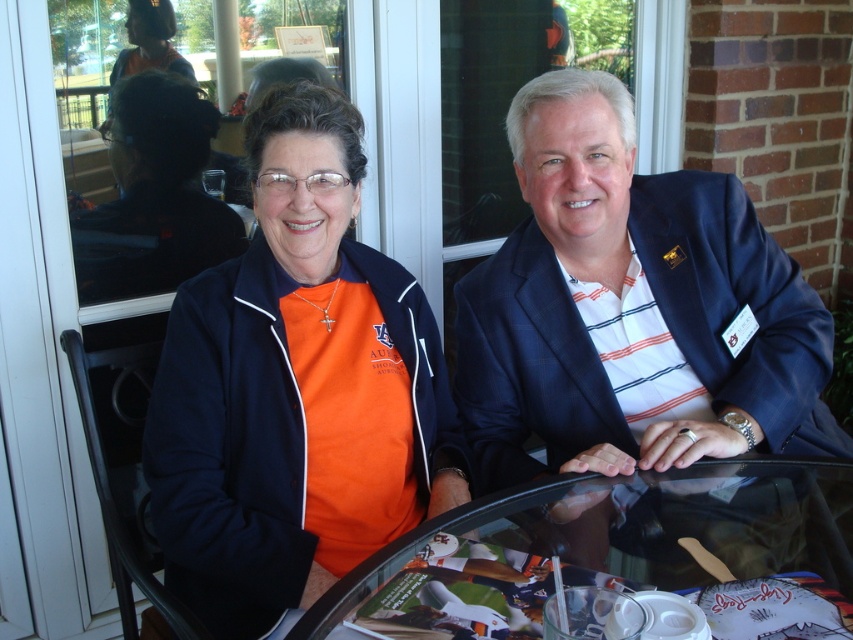
Question: Can you confirm if blue fabric suit at center is positioned to the left of transparent glass table at center?

Choices:
 (A) no
 (B) yes

Answer: (A)

Question: Which is farther from the transparent glass table at center?

Choices:
 (A) orange fabric shirt at center
 (B) blue fabric suit at center

Answer: (A)

Question: Among these points, which one is nearest to the camera?

Choices:
 (A) (323, 428)
 (B) (729, 221)
 (C) (630, 557)

Answer: (C)

Question: Where is orange fabric shirt at center located in relation to blue fabric suit at center in the image?

Choices:
 (A) above
 (B) below

Answer: (B)

Question: Is orange fabric shirt at center below transparent glass table at center?

Choices:
 (A) yes
 (B) no

Answer: (B)

Question: Which of these objects is positioned closest to the orange fabric shirt at center?

Choices:
 (A) blue fabric suit at center
 (B) transparent glass table at center

Answer: (A)